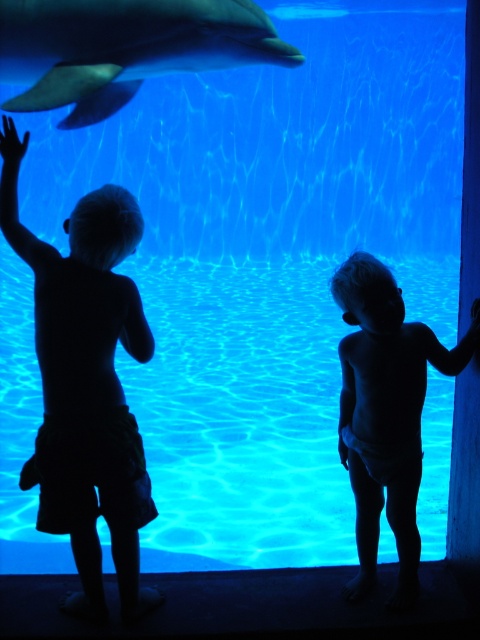
Does point (100, 509) come farther from viewer compared to point (164, 36)?

That is False.

Who is more forward, [67,464] or [104,36]?

Positioned in front is point [67,464].

This screenshot has height=640, width=480. I want to click on silhouette shorts at left, so click(85, 385).

Who is more distant from viewer, (10,22) or (389,470)?

Point (10,22)

Based on the photo, measure the distance from smooth gray dolphin at upper center to silhouette diaper at right.

5.49 feet

Is point (124, 70) farther from viewer compared to point (374, 499)?

Yes.

Locate an element on the screen. This screenshot has height=640, width=480. smooth gray dolphin at upper center is located at coordinates (123, 48).

Can you confirm if silhouette shorts at left is taller than silhouette diaper at right?

Indeed, silhouette shorts at left has a greater height compared to silhouette diaper at right.

Who is more distant from viewer, (96,291) or (355,349)?

The point (355,349) is behind.

Is point (26, 260) positioned in front of point (402, 595)?

Yes, point (26, 260) is closer to viewer.

Find the location of a particular element. silhouette shorts at left is located at coordinates (85, 385).